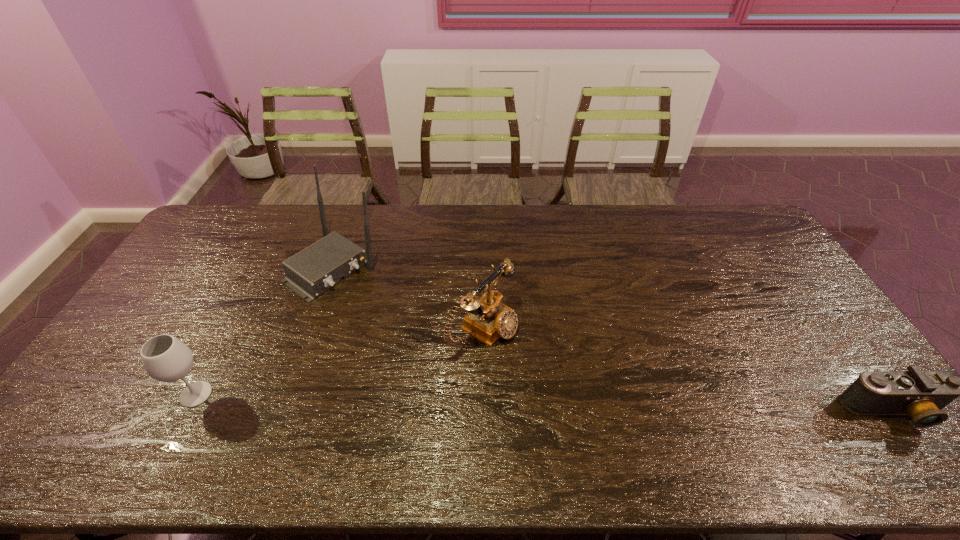
The image size is (960, 540). I want to click on vacant area at the left edge of the desktop, so click(194, 265).

Locate an element on the screen. vacant point at the far left corner is located at coordinates (224, 214).

Locate an element on the screen. This screenshot has width=960, height=540. blank space at the far right corner of the desktop is located at coordinates (716, 211).

Identify the location of free region at the near right corner. (829, 398).

This screenshot has height=540, width=960. In order to click on vacant space that is in between the router and the telephone in this screenshot , I will do `click(408, 299)`.

Where is `free space between the router and the shortest object`? This screenshot has height=540, width=960. free space between the router and the shortest object is located at coordinates (612, 340).

The image size is (960, 540). I want to click on free space between the telephone and the rightmost object, so click(687, 370).

Locate an element on the screen. The height and width of the screenshot is (540, 960). free space between the rightmost object and the wineglass is located at coordinates coord(543,403).

At what (x,y) coordinates should I click in order to perform the action: click on vacant area between the telephone and the rightmost object. Please return your answer as a coordinate pair (x, y). This screenshot has width=960, height=540. Looking at the image, I should click on (687, 370).

What are the coordinates of `unoccupied area between the third object from right to left and the third object from left to right` in the screenshot? It's located at (408, 299).